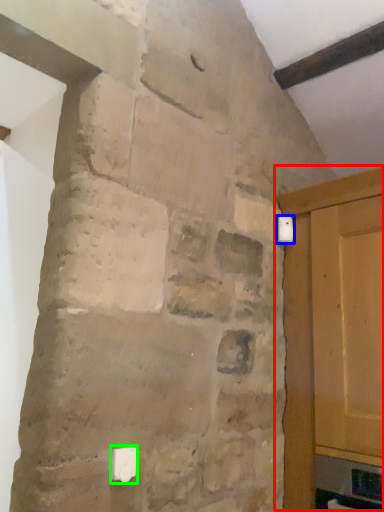
Question: Which object is the farthest from door (highlighted by a red box)? Choose among these: light switch (highlighted by a blue box) or light switch (highlighted by a green box).

Choices:
 (A) light switch
 (B) light switch

Answer: (B)